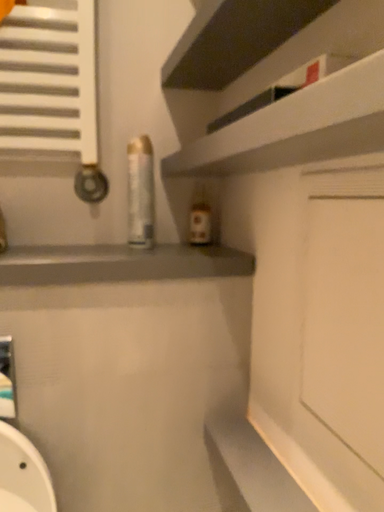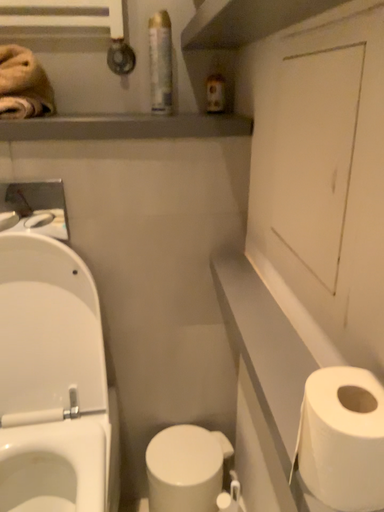
Question: How did the camera likely rotate when shooting the video?

Choices:
 (A) rotated left
 (B) rotated right

Answer: (A)